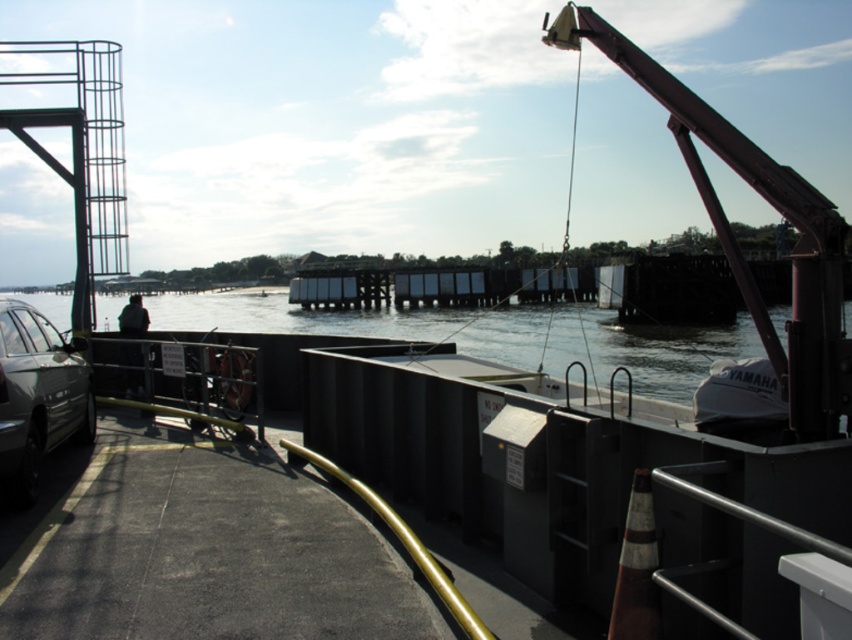
From the picture: Which is above, clear water at center or shiny silver car at lower left?

clear water at center is above.

The image size is (852, 640). What do you see at coordinates (295, 317) in the screenshot? I see `clear water at center` at bounding box center [295, 317].

The height and width of the screenshot is (640, 852). What are the coordinates of `clear water at center` in the screenshot? It's located at (295, 317).